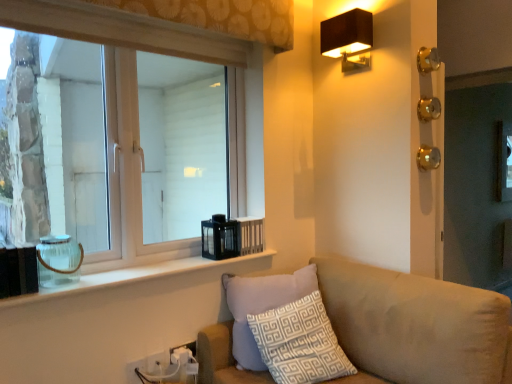
Describe the element at coordinates (261, 306) in the screenshot. I see `white patterned cushion at lower center` at that location.

Image resolution: width=512 pixels, height=384 pixels. What do you see at coordinates (127, 277) in the screenshot?
I see `clear glass jar at lower left` at bounding box center [127, 277].

Measure the distance between point (66, 275) and camera.

1.75 meters.

What is the approximate height of white plastic electric outlet at lower center, which ranks as the 2th electric outlet in right-to-left order?

The height of white plastic electric outlet at lower center, which ranks as the 2th electric outlet in right-to-left order, is 3.67 inches.

How much space does white plastic electric outlet at lower center, which ranks as the 3th electric outlet in front-to-back order, occupy horizontally?

white plastic electric outlet at lower center, which ranks as the 3th electric outlet in front-to-back order, is 0.47 inches in width.

Locate an element on the screen. This screenshot has height=384, width=512. white patterned cushion at lower center is located at coordinates (261, 306).

Is white patterned cushion at lower center to the right of white plastic electric outlet at lower center, which appears as the second electric outlet when viewed from the front, from the viewer's perspective?

Yes, white patterned cushion at lower center is to the right of white plastic electric outlet at lower center, which appears as the second electric outlet when viewed from the front.

Is point (248, 339) behind point (156, 369)?

Yes, it is.

Which object is closer to the camera, white patterned cushion at lower center or white plastic electric outlet at lower center, placed as the second electric outlet when sorted from back to front?

white patterned cushion at lower center is more forward.

Does point (195, 341) come behind point (29, 299)?

That is True.

In terms of size, does white plastic electric outlet at lower center, acting as the third electric outlet starting from the left, appear bigger or smaller than clear glass jar at lower left?

In the image, white plastic electric outlet at lower center, acting as the third electric outlet starting from the left, appears to be smaller than clear glass jar at lower left.

Considering the positions of objects white plastic electric outlet at lower center, which ranks as the 3th electric outlet in front-to-back order, and clear glass jar at lower left in the image provided, who is more to the right, white plastic electric outlet at lower center, which ranks as the 3th electric outlet in front-to-back order, or clear glass jar at lower left?

From the viewer's perspective, white plastic electric outlet at lower center, which ranks as the 3th electric outlet in front-to-back order, appears more on the right side.

Can you confirm if white plastic electric outlet at lower center, acting as the third electric outlet starting from the left, is smaller than clear glass window at upper left?

Yes, white plastic electric outlet at lower center, acting as the third electric outlet starting from the left, is smaller than clear glass window at upper left.

Is point (191, 343) farther from viewer compared to point (46, 32)?

Yes.

From the image's perspective, is white plastic electric outlet at lower center, acting as the third electric outlet starting from the left, under clear glass window at upper left?

Indeed, from the image's perspective, white plastic electric outlet at lower center, acting as the third electric outlet starting from the left, is shown beneath clear glass window at upper left.

Between white plastic electric outlet at lower center, the first electric outlet viewed from the right, and clear glass window at upper left, which one is positioned in front?

clear glass window at upper left is in front.

Which is less distant, (157, 364) or (308, 277)?

Positioned in front is point (157, 364).

Is white plastic electric outlet at lower center, which appears as the second electric outlet when viewed from the front, further to camera compared to white patterned cushion at lower center?

Yes, white plastic electric outlet at lower center, which appears as the second electric outlet when viewed from the front, is further from the camera.

Between white plastic electric outlet at lower center, the 2th electric outlet in the left-to-right sequence, and white patterned cushion at lower center, which one appears on the left side from the viewer's perspective?

white plastic electric outlet at lower center, the 2th electric outlet in the left-to-right sequence.

Is clear glass jar at left facing towards white plastic electric outlet at lower center, the first electric outlet viewed from the right?

No, clear glass jar at left is not facing towards white plastic electric outlet at lower center, the first electric outlet viewed from the right.

Considering the positions of objects clear glass jar at left and white plastic electric outlet at lower center, which ranks as the 3th electric outlet in front-to-back order, in the image provided, who is more to the right, clear glass jar at left or white plastic electric outlet at lower center, which ranks as the 3th electric outlet in front-to-back order,?

From the viewer's perspective, white plastic electric outlet at lower center, which ranks as the 3th electric outlet in front-to-back order, appears more on the right side.

Between clear glass jar at left and white plastic electric outlet at lower center, acting as the third electric outlet starting from the left, which one is positioned behind?

white plastic electric outlet at lower center, acting as the third electric outlet starting from the left, is behind.

Locate an element on the screen. The height and width of the screenshot is (384, 512). lamp lying behind the white plastic electric outlet at lower left, the first electric outlet from the front is located at coordinates (348, 39).

Considering the relative sizes of black fabric lampshade at upper right and white plastic electric outlet at lower left, positioned as the 3th electric outlet in back-to-front order, in the image provided, is black fabric lampshade at upper right thinner than white plastic electric outlet at lower left, positioned as the 3th electric outlet in back-to-front order,?

In fact, black fabric lampshade at upper right might be wider than white plastic electric outlet at lower left, positioned as the 3th electric outlet in back-to-front order.

Would you say black fabric lampshade at upper right contains white plastic electric outlet at lower left, positioned as the 3th electric outlet in back-to-front order?

No.

Considering the sizes of white plastic electric outlet at lower center, the 2th electric outlet in the left-to-right sequence, and black fabric lampshade at upper right in the image, is white plastic electric outlet at lower center, the 2th electric outlet in the left-to-right sequence, wider or thinner than black fabric lampshade at upper right?

In the image, white plastic electric outlet at lower center, the 2th electric outlet in the left-to-right sequence, appears to be more narrow than black fabric lampshade at upper right.

Based on their positions, is white plastic electric outlet at lower center, which appears as the second electric outlet when viewed from the front, located to the left or right of black fabric lampshade at upper right?

white plastic electric outlet at lower center, which appears as the second electric outlet when viewed from the front, is positioned on black fabric lampshade at upper right's left side.

Is white plastic electric outlet at lower center, which ranks as the 2th electric outlet in right-to-left order, taller or shorter than black fabric lampshade at upper right?

white plastic electric outlet at lower center, which ranks as the 2th electric outlet in right-to-left order, is shorter than black fabric lampshade at upper right.

From the white patterned cushion at lower center, count the 2nd electric outlet to the left and point to it. Please provide its 2D coordinates.

[(156, 362)]

You are a GUI agent. You are given a task and a screenshot of the screen. Output one action in this format:
    pyautogui.click(x=<x>, y=<y>)
    Task: Click on the window sill above the white plastic electric outlet at lower center, the first electric outlet viewed from the right (from the image's perspective)
    This screenshot has height=384, width=512.
    Given the screenshot: What is the action you would take?
    pyautogui.click(x=127, y=277)

In the scene shown: When comparing their distances from white patterned cushion at lower center, does black fabric lampshade at upper right or beige fabric couch at lower right seem further?

black fabric lampshade at upper right is further to white patterned cushion at lower center.

From the image, which object appears to be farther from white plastic electric outlet at lower left, the first electric outlet from the front, white plastic electric outlet at lower center, which is the first electric outlet in back-to-front order, or clear glass window at upper left?

clear glass window at upper left lies further to white plastic electric outlet at lower left, the first electric outlet from the front, than the other object.

Which object lies nearer to the anchor point white plastic electric outlet at lower left, the 3th electric outlet when ordered from right to left, clear glass window at upper left or white plastic electric outlet at lower center, which ranks as the 2th electric outlet in right-to-left order?

The object closer to white plastic electric outlet at lower left, the 3th electric outlet when ordered from right to left, is white plastic electric outlet at lower center, which ranks as the 2th electric outlet in right-to-left order.

Based on the photo, from the image, which object appears to be nearer to clear glass jar at left, white plastic electric outlet at lower left, the first electric outlet from the front, or white patterned cushion at lower center?

white plastic electric outlet at lower left, the first electric outlet from the front, lies closer to clear glass jar at left than the other object.

Considering their positions, is black fabric lampshade at upper right positioned further to white plastic electric outlet at lower center, placed as the second electric outlet when sorted from back to front, than clear glass jar at left?

Among the two, black fabric lampshade at upper right is located further to white plastic electric outlet at lower center, placed as the second electric outlet when sorted from back to front.

From the picture: Based on their spatial positions, is beige fabric couch at lower right or clear glass jar at left closer to clear glass window at upper left?

Based on the image, clear glass jar at left appears to be nearer to clear glass window at upper left.

Looking at the image, which one is located further to clear glass window at upper left, white patterned cushion at lower center or white plastic electric outlet at lower left, which is counted as the 1th electric outlet, starting from the left?

white plastic electric outlet at lower left, which is counted as the 1th electric outlet, starting from the left, lies further to clear glass window at upper left than the other object.

From the image, which object appears to be farther from clear glass jar at lower left, black fabric lampshade at upper right or white plastic electric outlet at lower center, which ranks as the 3th electric outlet in front-to-back order?

black fabric lampshade at upper right is further to clear glass jar at lower left.

Identify the location of glass vase that lies between black fabric lampshade at upper right and white patterned cushion at lower center from top to bottom. Image resolution: width=512 pixels, height=384 pixels. (58, 260).

Locate an element on the screen. This screenshot has height=384, width=512. pillow between black fabric lampshade at upper right and white plastic electric outlet at lower center, which is the first electric outlet in back-to-front order, vertically is located at coordinates (261, 306).

At what (x,y) coordinates should I click in order to perform the action: click on glass vase between clear glass window at upper left and clear glass jar at lower left in the up-down direction. Please return your answer as a coordinate pair (x, y). The height and width of the screenshot is (384, 512). Looking at the image, I should click on (58, 260).

What are the coordinates of `window between black fabric lampshade at upper right and white plastic electric outlet at lower center, the 2th electric outlet in the left-to-right sequence, in the vertical direction` in the screenshot? It's located at (129, 176).